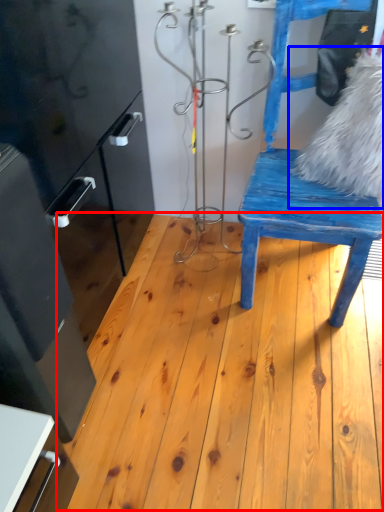
Question: Which object is closer to the camera taking this photo, hardwood (highlighted by a red box) or animal (highlighted by a blue box)?

Choices:
 (A) hardwood
 (B) animal

Answer: (A)